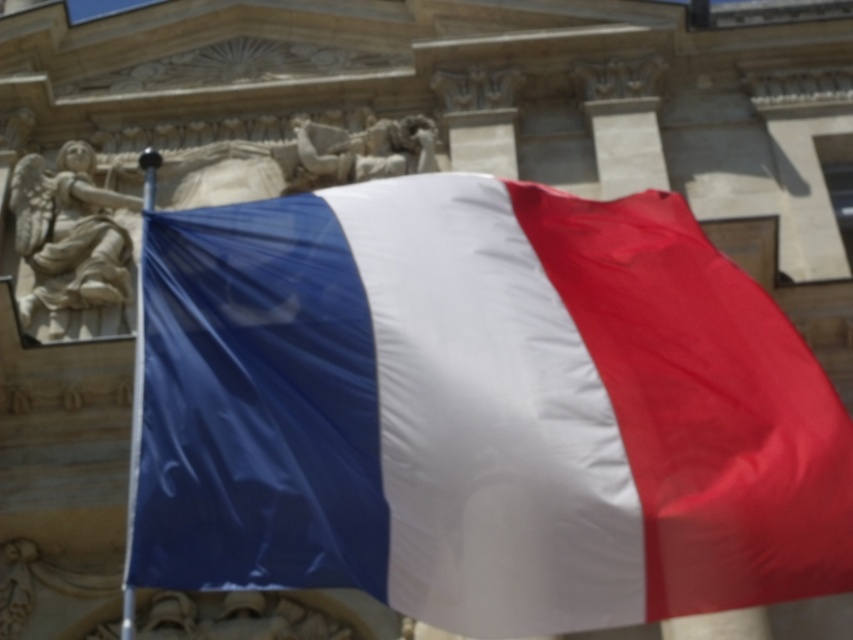
You are an event organizer setting up a flag display. The silky fabric flag at center must be placed exactly 40 meters away from the polished stone figures at center. Based on the current setup shown in the image, is the flag positioned correctly?

The silky fabric flag at center is currently 37.95 meters away from the polished stone figures at center, which is 2.05 meters shorter than the required distance. The flag needs to be moved further away to meet the 40 meter requirement.

You are an architect examining the building facade. You notice the silky fabric flag at center and the white stone angel at upper left. Which object is closer to the viewer?

The silky fabric flag at center is closer to the viewer because it is in front of the white stone angel at upper left.

You are standing in front of a French flag displayed in a classical building. The flag is represented by the point at coordinates point (480, 410). If you were to walk directly towards the flag, which direction relative to the building facade should you move? Please answer with either left, right, forward, backward, or a combination of these directions.

Since the silky fabric flag at center is represented by point (480, 410), you should move forward towards the flag as it is positioned at the center of the scene. The building facade is behind the flag, so moving forward would bring you closer to the flag while facing the building.